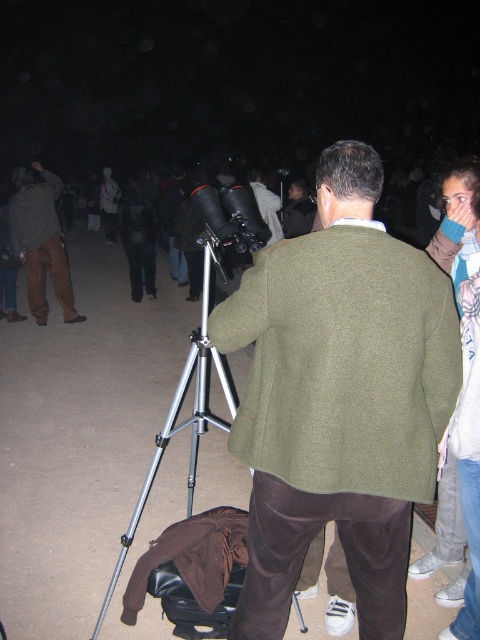
Question: Is green woolen sweater at center to the left of brown cotton pants at left from the viewer's perspective?

Choices:
 (A) yes
 (B) no

Answer: (B)

Question: Where is green woolen sweater at center located in relation to silver metallic tripod at center in the image?

Choices:
 (A) below
 (B) above

Answer: (B)

Question: Is silver metallic tripod at center to the left of brown cotton pants at left from the viewer's perspective?

Choices:
 (A) yes
 (B) no

Answer: (B)

Question: Based on their relative distances, which object is farther from the dark green wool sweater at upper left?

Choices:
 (A) green woolen sweater at center
 (B) silver metallic tripod at center
 (C) brown cotton pants at left

Answer: (A)

Question: Which object is the closest to the dark green wool sweater at upper left?

Choices:
 (A) brown cotton pants at left
 (B) green woolen sweater at center

Answer: (A)

Question: Based on their relative distances, which object is farther from the silver metallic tripod at center?

Choices:
 (A) brown cotton pants at left
 (B) dark green wool sweater at upper left

Answer: (B)